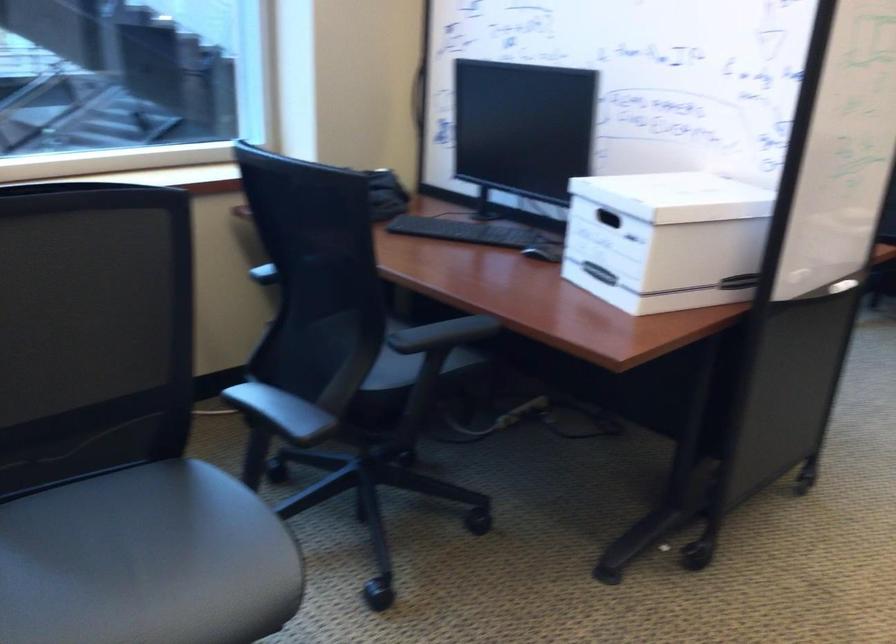
Find where to lift the box handle cutout. Please return your answer as a coordinate pair (x, y).

(607, 218)